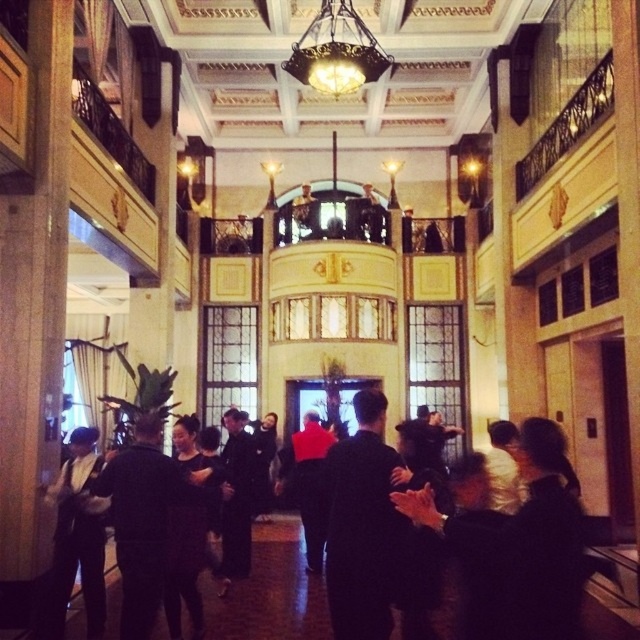
Which of these two, gold textured chandelier at upper center or black fabric coat at center, stands shorter?

Standing shorter between the two is gold textured chandelier at upper center.

Between gold textured chandelier at upper center and black fabric coat at center, which one appears on the right side from the viewer's perspective?

gold textured chandelier at upper center

Find the location of a particular element. The image size is (640, 640). gold textured chandelier at upper center is located at coordinates (337, 51).

Can you confirm if black matte dress at center is positioned above black suit at left?

No, black matte dress at center is not above black suit at left.

Is black matte dress at center to the right of black suit at left from the viewer's perspective?

Indeed, black matte dress at center is positioned on the right side of black suit at left.

Image resolution: width=640 pixels, height=640 pixels. What are the coordinates of `black matte dress at center` in the screenshot? It's located at (272, 593).

You are a GUI agent. You are given a task and a screenshot of the screen. Output one action in this format:
    pyautogui.click(x=<x>, y=<y>)
    Task: Click on the black matte dress at center
    This screenshot has height=640, width=640.
    Given the screenshot: What is the action you would take?
    pyautogui.click(x=272, y=593)

Is black fabric coat at center taller than red fabric jacket at center?

No, black fabric coat at center is not taller than red fabric jacket at center.

Which is above, black fabric coat at center or red fabric jacket at center?

black fabric coat at center

Does point (234, 500) lie in front of point (292, 456)?

Yes, point (234, 500) is in front of point (292, 456).

Identify the location of black fabric coat at center. The image size is (640, 640). (236, 496).